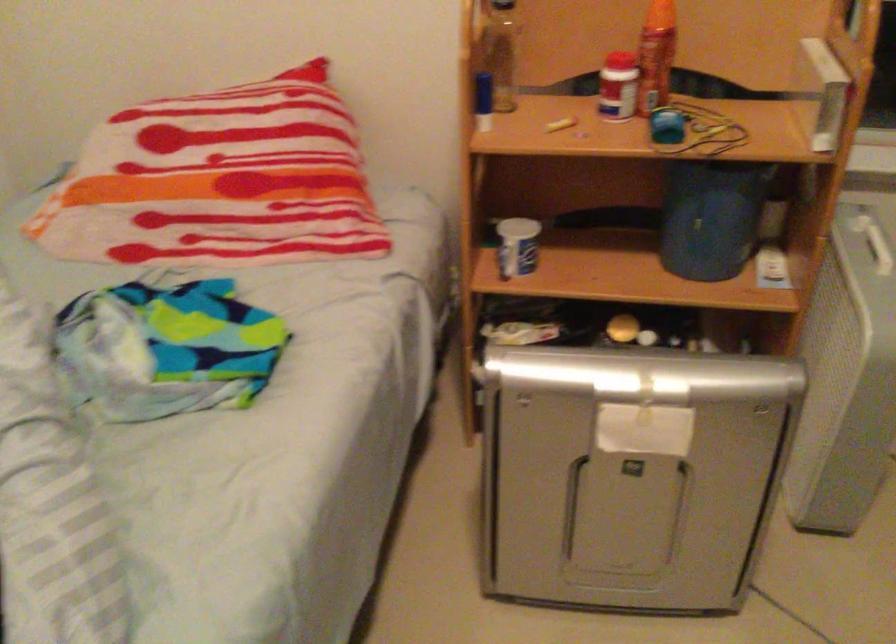
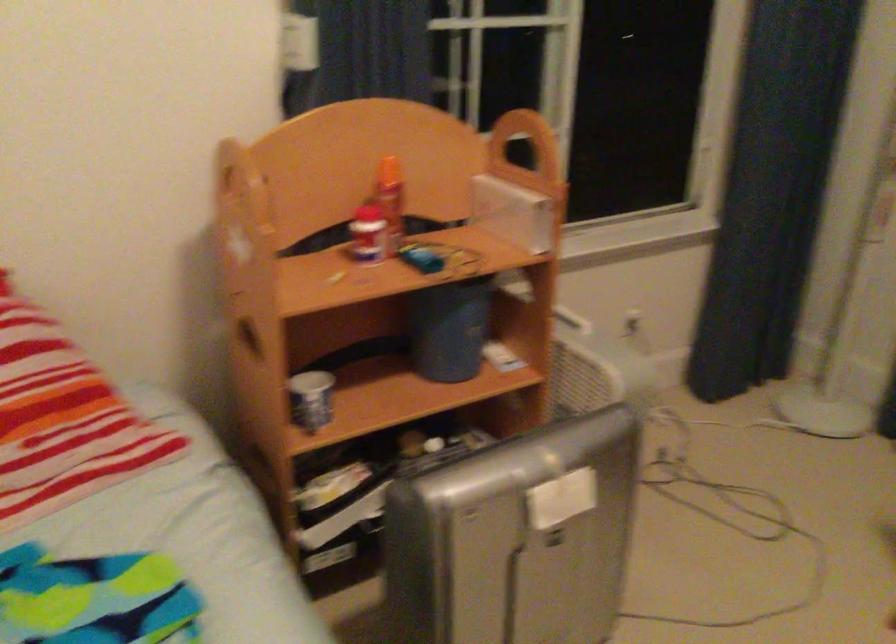
Question: The images are taken continuously from a first-person perspective. In which direction is your viewpoint rotating?

Choices:
 (A) Left
 (B) Right
 (C) Up
 (D) Down

Answer: (B)